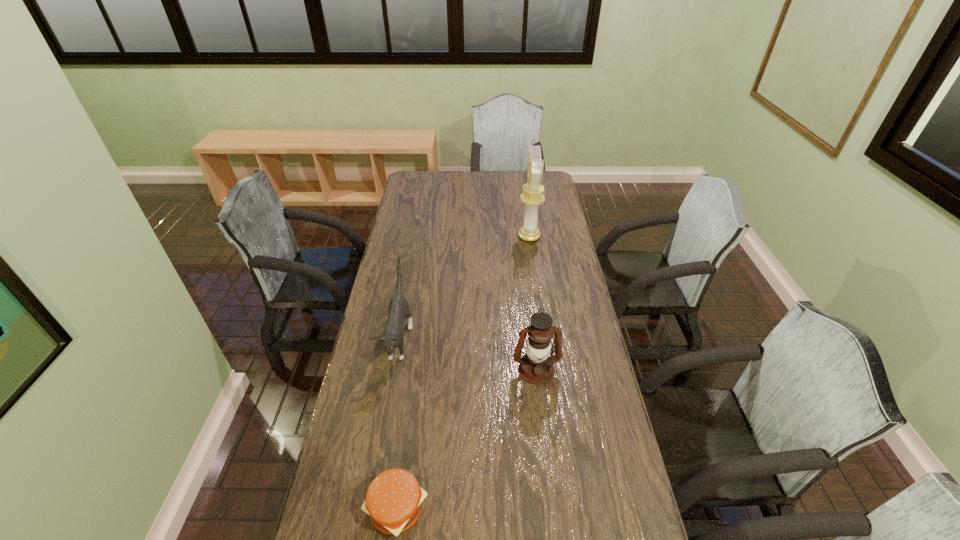
Identify the location of free point that satisfies the following two spatial constraints: 1. on the front-facing side of the award; 2. on the side of the lantern, there is a wick adjustment knob. The width and height of the screenshot is (960, 540). (548, 370).

The image size is (960, 540). I want to click on vacant region that satisfies the following two spatial constraints: 1. on the front-facing side of the award; 2. at the face of the second shortest object, so pyautogui.click(x=543, y=339).

I want to click on vacant space that satisfies the following two spatial constraints: 1. on the front-facing side of the farthest object; 2. at the face of the third tallest object, so click(x=543, y=339).

Identify the location of free space that satisfies the following two spatial constraints: 1. on the front-facing side of the award; 2. on the side of the second tallest object, there is a wick adjustment knob. (548, 370).